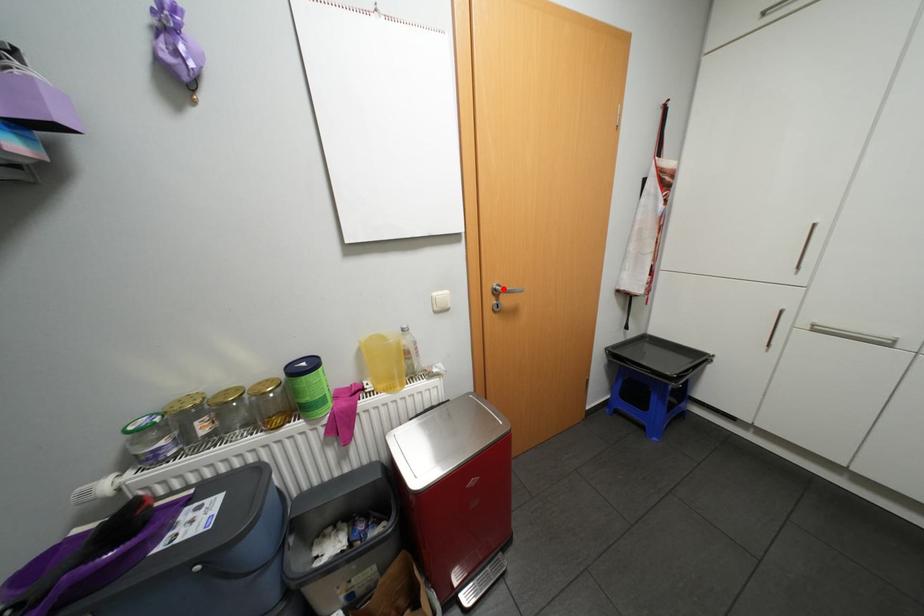
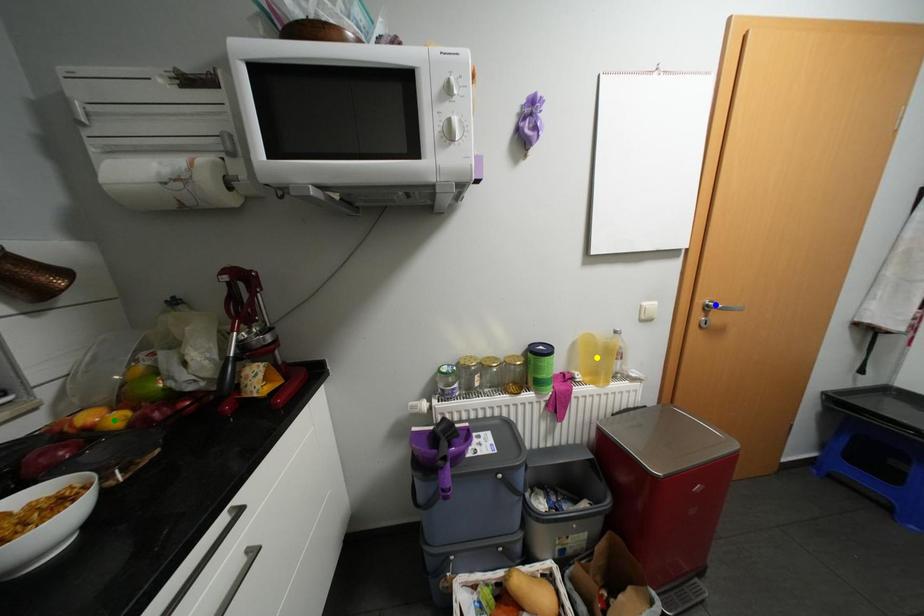
Question: I am providing you with two images of the same scene from different viewpoints. A red point is marked on the first image. You are given multiple points on the second image. Which spot in image 2 lines up with the point in image 1?

Choices:
 (A) green point
 (B) yellow point
 (C) blue point

Answer: (C)